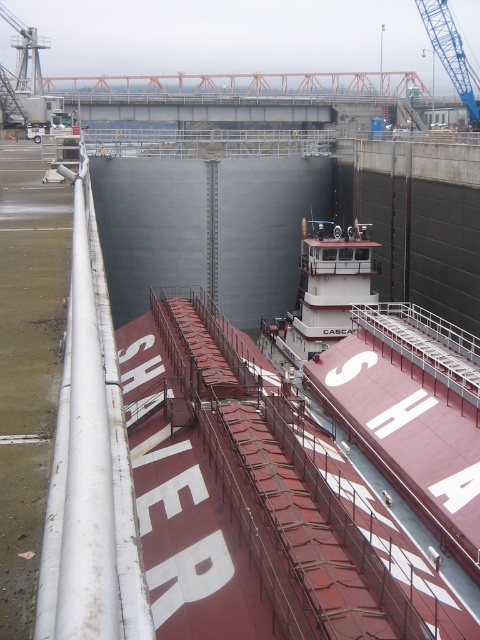
You are a crane operator in the shipyard. You need to move a container from the maroon matte barge at center to a storage area. The container is currently at point (388, 380). Is the container located on the barge?

Yes, the container is located on the maroon matte barge at center because the point (388, 380) indicates the maroon matte barge at center.